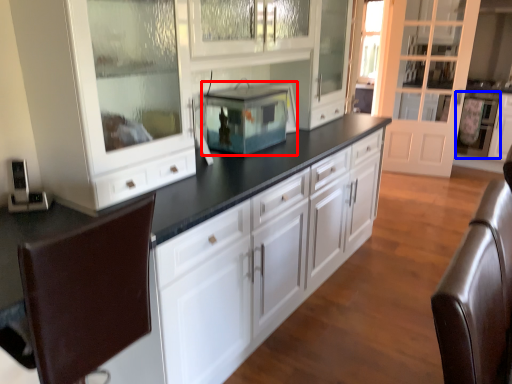
Question: Among these objects, which one is farthest to the camera, home appliance (highlighted by a red box) or appliance (highlighted by a blue box)?

Choices:
 (A) home appliance
 (B) appliance

Answer: (B)